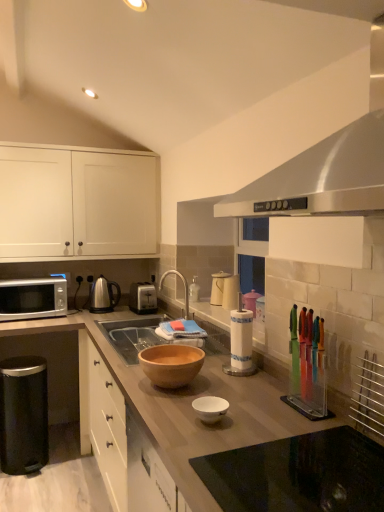
Question: Is white matte cabinet at upper left thinner than satin silver toaster at center, placed as the fourth appliance when sorted from right to left?

Choices:
 (A) no
 (B) yes

Answer: (A)

Question: From a real-world perspective, is white matte cabinet at upper left on top of satin silver toaster at center, acting as the 5th appliance starting from the front?

Choices:
 (A) yes
 (B) no

Answer: (A)

Question: Is white matte cabinet at upper left to the left of satin silver toaster at center, placed as the fourth appliance when sorted from right to left, from the viewer's perspective?

Choices:
 (A) yes
 (B) no

Answer: (A)

Question: From the image's perspective, would you say white matte cabinet at upper left is shown under satin silver toaster at center, positioned as the first appliance in back-to-front order?

Choices:
 (A) no
 (B) yes

Answer: (A)

Question: Considering the relative positions of white matte cabinet at upper left and satin silver toaster at center, acting as the 5th appliance starting from the front, in the image provided, is white matte cabinet at upper left behind satin silver toaster at center, acting as the 5th appliance starting from the front,?

Choices:
 (A) yes
 (B) no

Answer: (B)

Question: Considering the positions of wooden bowl at center and satin nickel tea pot at center in the image, is wooden bowl at center wider or thinner than satin nickel tea pot at center?

Choices:
 (A) wide
 (B) thin

Answer: (A)

Question: Visually, is wooden bowl at center positioned to the left or to the right of satin nickel tea pot at center?

Choices:
 (A) left
 (B) right

Answer: (B)

Question: From the image's perspective, relative to satin nickel tea pot at center, is wooden bowl at center above or below?

Choices:
 (A) above
 (B) below

Answer: (B)

Question: Relative to satin nickel tea pot at center, is wooden bowl at center in front or behind?

Choices:
 (A) front
 (B) behind

Answer: (A)

Question: From a real-world perspective, is silver metallic microwave at left positioned above or below wooden bowl at center, the first bowl viewed from the back?

Choices:
 (A) below
 (B) above

Answer: (B)

Question: Would you say silver metallic microwave at left is to the left or to the right of wooden bowl at center, the 2th bowl when ordered from front to back, in the picture?

Choices:
 (A) right
 (B) left

Answer: (B)

Question: Considering the positions of point (24, 286) and point (187, 352), is point (24, 286) closer or farther from the camera than point (187, 352)?

Choices:
 (A) farther
 (B) closer

Answer: (A)

Question: Is silver metallic microwave at left in front of or behind wooden bowl at center, the first bowl viewed from the back, in the image?

Choices:
 (A) behind
 (B) front

Answer: (A)

Question: From their relative heights in the image, would you say satin silver exhaust hood at upper center is taller or shorter than metallic silver rack at right, the first appliance positioned from the right?

Choices:
 (A) short
 (B) tall

Answer: (B)

Question: Based on their sizes in the image, would you say satin silver exhaust hood at upper center is bigger or smaller than metallic silver rack at right, the first appliance positioned from the right?

Choices:
 (A) big
 (B) small

Answer: (A)